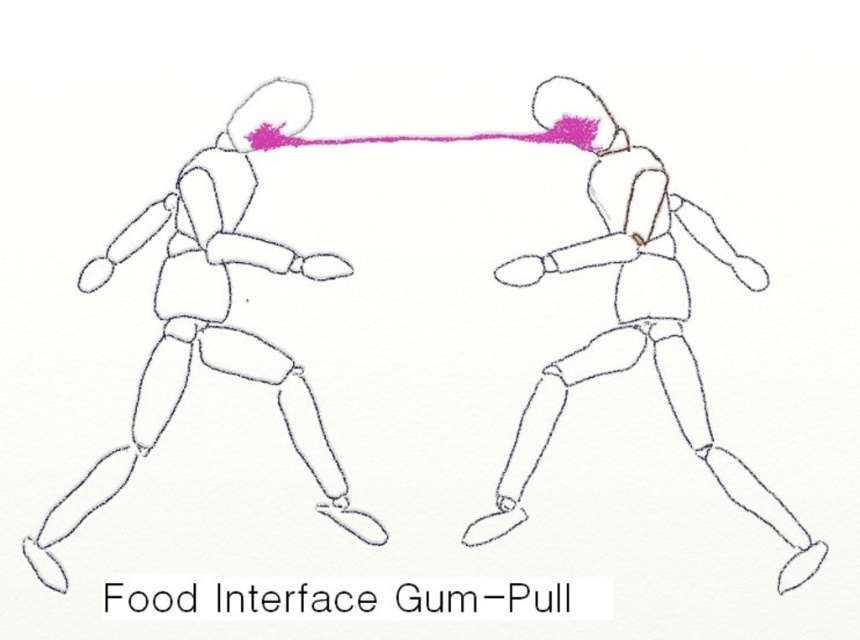
Question: Can you confirm if matte black figure at left is positioned above smooth white figure at center?

Choices:
 (A) no
 (B) yes

Answer: (A)

Question: Is matte black figure at left positioned at the back of smooth white figure at center?

Choices:
 (A) no
 (B) yes

Answer: (B)

Question: Which object is farther from the camera taking this photo?

Choices:
 (A) smooth white figure at center
 (B) matte black figure at left

Answer: (B)

Question: Which of the following is the closest to the observer?

Choices:
 (A) smooth white figure at center
 (B) matte black figure at left

Answer: (A)

Question: Which of the following is the farthest from the observer?

Choices:
 (A) smooth white figure at center
 (B) matte black figure at left

Answer: (B)

Question: Is matte black figure at left smaller than smooth white figure at center?

Choices:
 (A) yes
 (B) no

Answer: (A)